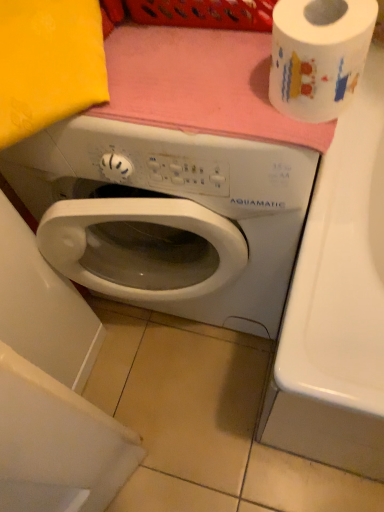
Question: Considering their positions, is white glossy toilet paper at upper right located in front of or behind white glossy washing machine at center?

Choices:
 (A) behind
 (B) front

Answer: (B)

Question: In terms of size, does white glossy toilet paper at upper right appear bigger or smaller than white glossy washing machine at center?

Choices:
 (A) big
 (B) small

Answer: (B)

Question: Considering the positions of point (357, 81) and point (44, 224), is point (357, 81) closer or farther from the camera than point (44, 224)?

Choices:
 (A) farther
 (B) closer

Answer: (B)

Question: Considering their positions, is white glossy washing machine at center located in front of or behind white glossy toilet paper at upper right?

Choices:
 (A) front
 (B) behind

Answer: (B)

Question: Is white glossy washing machine at center situated inside white glossy toilet paper at upper right or outside?

Choices:
 (A) outside
 (B) inside

Answer: (A)

Question: From the image's perspective, is white glossy washing machine at center above or below white glossy toilet paper at upper right?

Choices:
 (A) above
 (B) below

Answer: (B)

Question: From a real-world perspective, is white glossy washing machine at center physically located above or below white glossy toilet paper at upper right?

Choices:
 (A) below
 (B) above

Answer: (A)